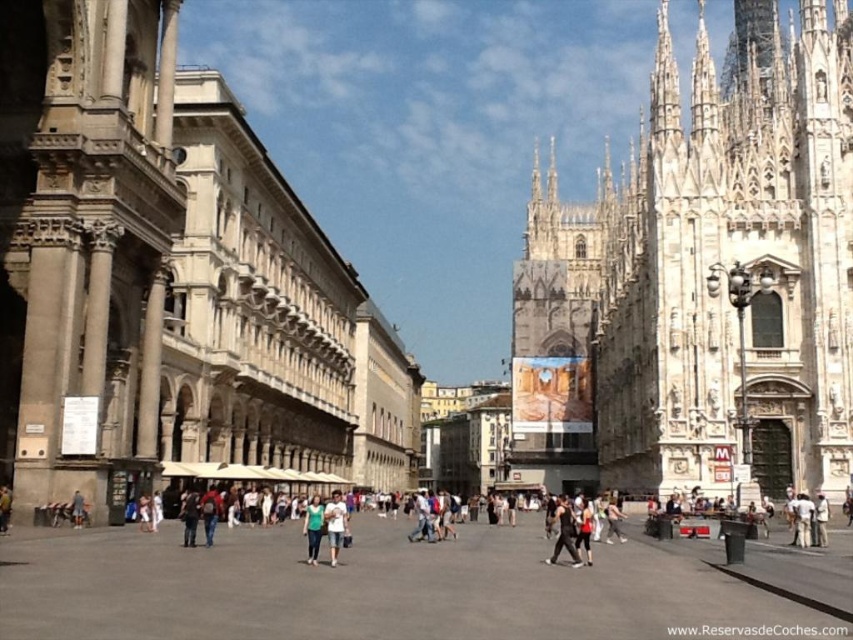
At what (x,y) coordinates should I click in order to perform the action: click on white stone church at upper right. Please return your answer as a coordinate pair (x, y). This screenshot has width=853, height=640. Looking at the image, I should click on (715, 264).

Which is more to the left, white stone church at upper right or denim jeans at center?

denim jeans at center

Between point (834, 100) and point (183, 513), which one is positioned in front?

Point (183, 513) is in front.

Where is `white stone church at upper right`? This screenshot has height=640, width=853. white stone church at upper right is located at coordinates (715, 264).

Based on the photo, which of these two, green fabric shirt at center or denim jeans at center, stands taller?

green fabric shirt at center

Between green fabric shirt at center and denim jeans at center, which one appears on the right side from the viewer's perspective?

From the viewer's perspective, green fabric shirt at center appears more on the right side.

The width and height of the screenshot is (853, 640). In order to click on green fabric shirt at center in this screenshot , I will do `click(312, 528)`.

Between white stone church at upper right and dark gray fabric jacket at center, which one is positioned lower?

dark gray fabric jacket at center is lower down.

Can you confirm if white stone church at upper right is positioned above dark gray fabric jacket at center?

Yes, white stone church at upper right is above dark gray fabric jacket at center.

In the scene shown: Measure the distance between point (764,237) and camera.

90.37 meters

Find the location of a particular element. The width and height of the screenshot is (853, 640). white stone church at upper right is located at coordinates (715, 264).